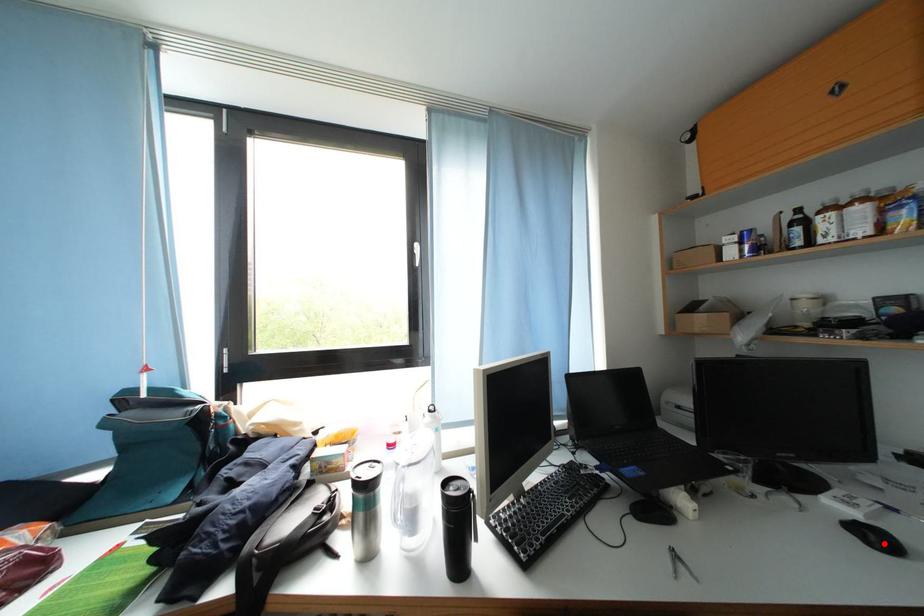
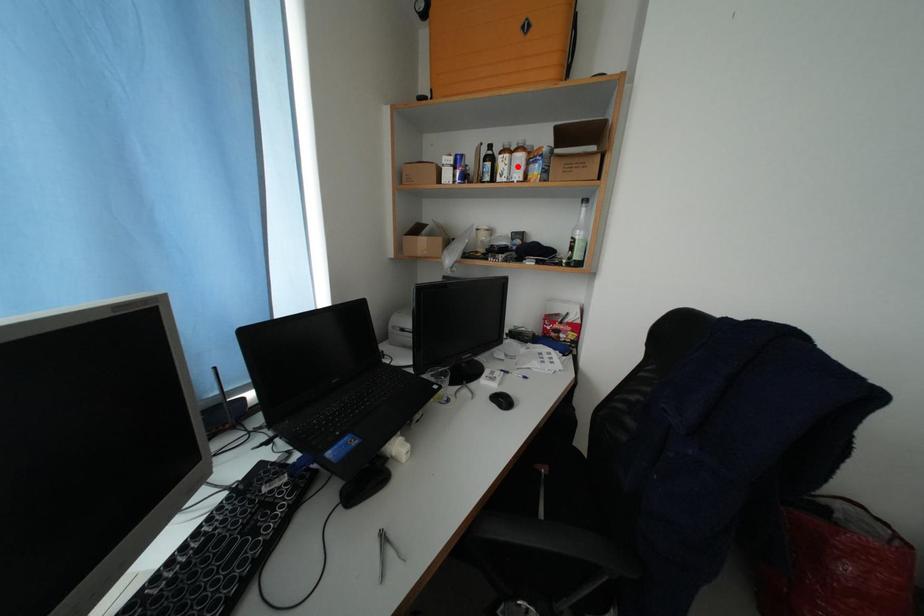
I am providing you with two images of the same scene from different viewpoints. A red point is marked on the first image and another point is marked on the second image. Do the highlighted points in image1 and image2 indicate the same real-world spot?

No